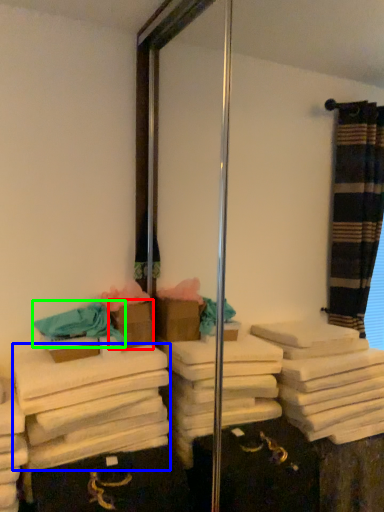
Question: Based on their relative distances, which object is farther from box (highlighted by a red box)? Choose from bath towel (highlighted by a blue box) and bath towel (highlighted by a green box).

Choices:
 (A) bath towel
 (B) bath towel

Answer: (A)